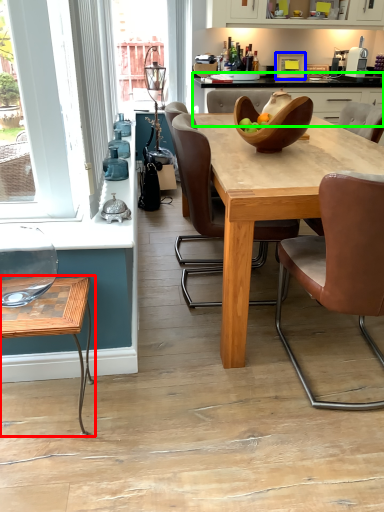
Question: Which object is the closest to the coffee table (highlighted by a red box)? Choose among these: appliance (highlighted by a blue box) or counter (highlighted by a green box).

Choices:
 (A) appliance
 (B) counter

Answer: (B)